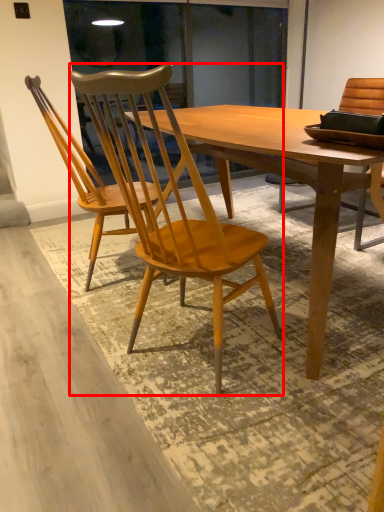
Question: From the image, what is the correct spatial relationship of chair (annotated by the red box) in relation to chair?

Choices:
 (A) right
 (B) left

Answer: (A)